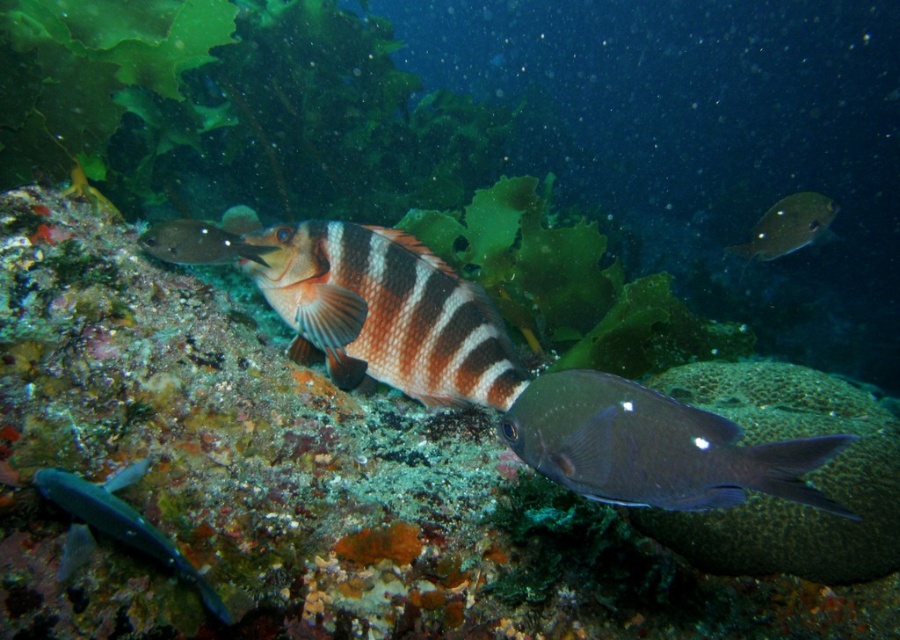
Question: Is the position of brown matte fish at center more distant than that of shiny silver fish at upper left?

Choices:
 (A) no
 (B) yes

Answer: (A)

Question: Is shiny silver fish at upper right closer to the viewer compared to shiny silver fish at upper left?

Choices:
 (A) yes
 (B) no

Answer: (B)

Question: Which object is closer to the camera taking this photo?

Choices:
 (A) shiny blue fish at lower left
 (B) shiny silver fish at upper right
 (C) brown matte fish at center
 (D) shiny silver fish at upper left

Answer: (A)

Question: Which of these objects is positioned closest to the shiny dark blue fish at center?

Choices:
 (A) shiny blue fish at lower left
 (B) shiny silver fish at upper left
 (C) brown matte fish at center

Answer: (C)

Question: Is shiny dark blue fish at center closer to camera compared to shiny blue fish at lower left?

Choices:
 (A) no
 (B) yes

Answer: (B)

Question: Estimate the real-world distances between objects in this image. Which object is closer to the shiny silver fish at upper right?

Choices:
 (A) shiny silver fish at upper left
 (B) shiny dark blue fish at center

Answer: (A)